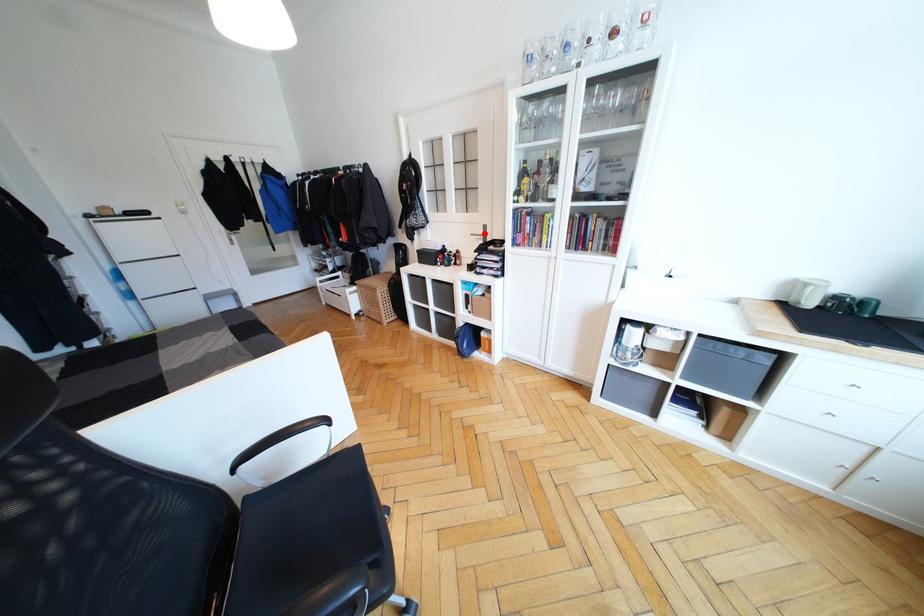
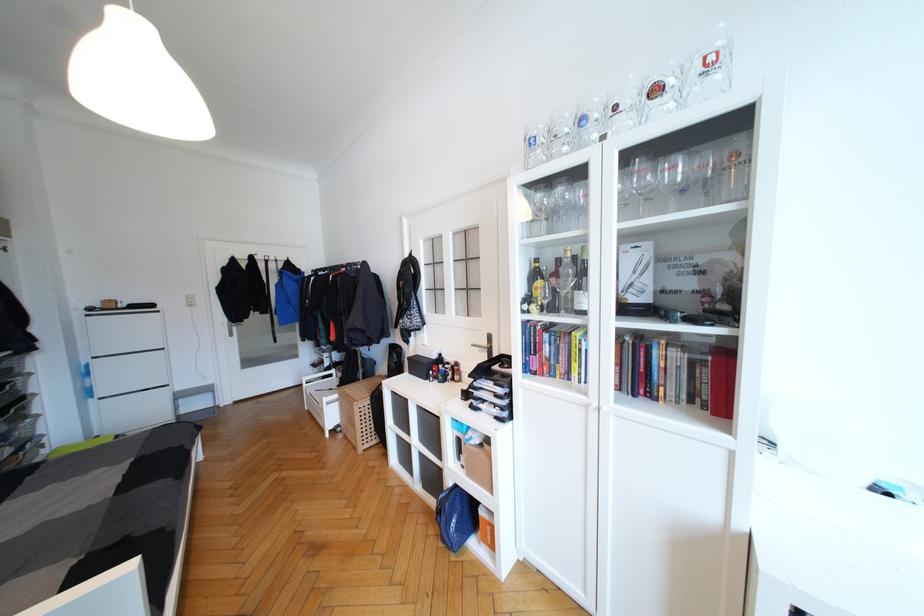
Question: I am providing you with two images of the same scene from different viewpoints. In image1, a red point is highlighted. Considering the same 3D point in image2, which of the following is correct?

Choices:
 (A) It is closer
 (B) It is farther

Answer: (B)